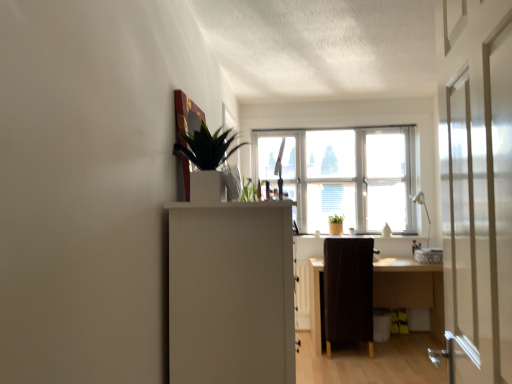
This screenshot has height=384, width=512. Find the location of `white glossy window sill at center`. white glossy window sill at center is located at coordinates (391, 237).

Identify the location of green glossy plant at upper center. Image resolution: width=512 pixels, height=384 pixels. (206, 148).

This screenshot has height=384, width=512. Find the location of `dark brown fabric chair at center`. dark brown fabric chair at center is located at coordinates (348, 291).

I want to click on wooden desk at center, so pyautogui.click(x=410, y=288).

Is white glossy screen door at right taller or shorter than green glossy plant at upper center?

Clearly, white glossy screen door at right is taller compared to green glossy plant at upper center.

Is white glossy screen door at right bigger than green glossy plant at upper center?

Yes, white glossy screen door at right is bigger than green glossy plant at upper center.

Considering the relative sizes of wooden desk at center and green glossy plant at upper center in the image provided, is wooden desk at center thinner than green glossy plant at upper center?

In fact, wooden desk at center might be wider than green glossy plant at upper center.

Does wooden desk at center come behind green glossy plant at upper center?

Yes, it is behind green glossy plant at upper center.

Would you say green glossy plant at upper center is part of wooden desk at center's contents?

Definitely not — green glossy plant at upper center is not inside wooden desk at center.

Who is taller, wooden desk at center or green glossy plant at upper center?

wooden desk at center is taller.

Is wooden desk at center looking in the opposite direction of white glossy screen door at right?

No.

Is white glossy screen door at right surrounded by wooden desk at center?

No, white glossy screen door at right is not a part of wooden desk at center.

Would you consider wooden desk at center to be distant from white glossy screen door at right?

Yes, wooden desk at center is far from white glossy screen door at right.

Is point (386, 300) in front of point (447, 278)?

That is False.

Can you confirm if transparent glass window at center is smaller than white glossy window sill at center?

Incorrect, transparent glass window at center is not smaller in size than white glossy window sill at center.

Looking at this image, are transparent glass window at center and white glossy window sill at center making contact?

No, transparent glass window at center is not in contact with white glossy window sill at center.

Considering the relative positions of transparent glass window at center and white glossy window sill at center in the image provided, is transparent glass window at center to the left of white glossy window sill at center from the viewer's perspective?

Correct, you'll find transparent glass window at center to the left of white glossy window sill at center.

From the image's perspective, relative to white glossy window sill at center, is transparent glass window at center above or below?

transparent glass window at center is situated higher than white glossy window sill at center in the image.

From the image's perspective, does white glossy window sill at center appear higher than wooden desk at center?

Yes, from the image's perspective, white glossy window sill at center is above wooden desk at center.

Can you confirm if white glossy window sill at center is smaller than wooden desk at center?

Indeed, white glossy window sill at center has a smaller size compared to wooden desk at center.

Is white glossy window sill at center far from wooden desk at center?

That's not correct — white glossy window sill at center is a little close to wooden desk at center.

From the image's perspective, is white glossy window sill at center located above white glossy screen door at right?

Incorrect, from the image's perspective, white glossy window sill at center is lower than white glossy screen door at right.

This screenshot has width=512, height=384. What are the coordinates of `window sill below the white glossy screen door at right (from the image's perspective)` in the screenshot? It's located at click(x=391, y=237).

From their relative heights in the image, would you say white glossy window sill at center is taller or shorter than white glossy screen door at right?

white glossy window sill at center is shorter than white glossy screen door at right.

Measure the distance between white glossy window sill at center and white glossy screen door at right.

They are 3.31 meters apart.

How different are the orientations of wooden desk at center and dark brown fabric chair at center in degrees?

There is a 179-degree angle between the facing directions of wooden desk at center and dark brown fabric chair at center.

Find the location of a particular element. This screenshot has width=512, height=384. furniture in front of the wooden desk at center is located at coordinates (348, 291).

From the image's perspective, is wooden desk at center positioned above or below dark brown fabric chair at center?

From the image's perspective, wooden desk at center appears below dark brown fabric chair at center.

From a real-world perspective, is wooden desk at center physically above dark brown fabric chair at center?

Actually, wooden desk at center is physically below dark brown fabric chair at center in the real world.

Where is `houseplant that is above the white glossy screen door at right (from a real-world perspective)`? This screenshot has height=384, width=512. houseplant that is above the white glossy screen door at right (from a real-world perspective) is located at coordinates (206, 148).

Identify the location of houseplant above the wooden desk at center (from the image's perspective). This screenshot has width=512, height=384. (206, 148).

Based on the photo, from the image, which object appears to be nearer to transparent glass window at center, wooden desk at center or green glossy plant at upper center?

Among the two, wooden desk at center is located nearer to transparent glass window at center.

Based on their spatial positions, is white matte cabinet at center or white glossy window sill at center further from white glossy screen door at right?

white glossy window sill at center is positioned further to the anchor white glossy screen door at right.

From the image, which object appears to be farther from wooden desk at center, green glossy plant at upper center or transparent glass window at center?

green glossy plant at upper center is positioned further to the anchor wooden desk at center.

From the image, which object appears to be nearer to wooden desk at center, transparent glass window at center or white matte cabinet at center?

Based on the image, transparent glass window at center appears to be nearer to wooden desk at center.

Which object lies further to the anchor point transparent glass window at center, dark brown fabric chair at center or white glossy window sill at center?

The object further to transparent glass window at center is dark brown fabric chair at center.

Which object lies further to the anchor point dark brown fabric chair at center, wooden desk at center or green glossy plant at upper center?

green glossy plant at upper center is positioned further to the anchor dark brown fabric chair at center.

Which object lies nearer to the anchor point green glossy plant at upper center, white glossy window sill at center or transparent glass window at center?

Among the two, transparent glass window at center is located nearer to green glossy plant at upper center.

Based on their spatial positions, is white glossy screen door at right or wooden desk at center further from green glossy plant at upper center?

wooden desk at center is further to green glossy plant at upper center.

Locate an element on the screen. houseplant located between white matte cabinet at center and dark brown fabric chair at center in the depth direction is located at coordinates (206, 148).

Locate an element on the screen. The width and height of the screenshot is (512, 384). houseplant between white glossy screen door at right and white glossy window sill at center in the front-back direction is located at coordinates (206, 148).

Locate an element on the screen. window sill between transparent glass window at center and wooden desk at center in the up-down direction is located at coordinates (391, 237).

This screenshot has width=512, height=384. Find the location of `furniture between transparent glass window at center and wooden desk at center in the up-down direction`. furniture between transparent glass window at center and wooden desk at center in the up-down direction is located at coordinates (348, 291).